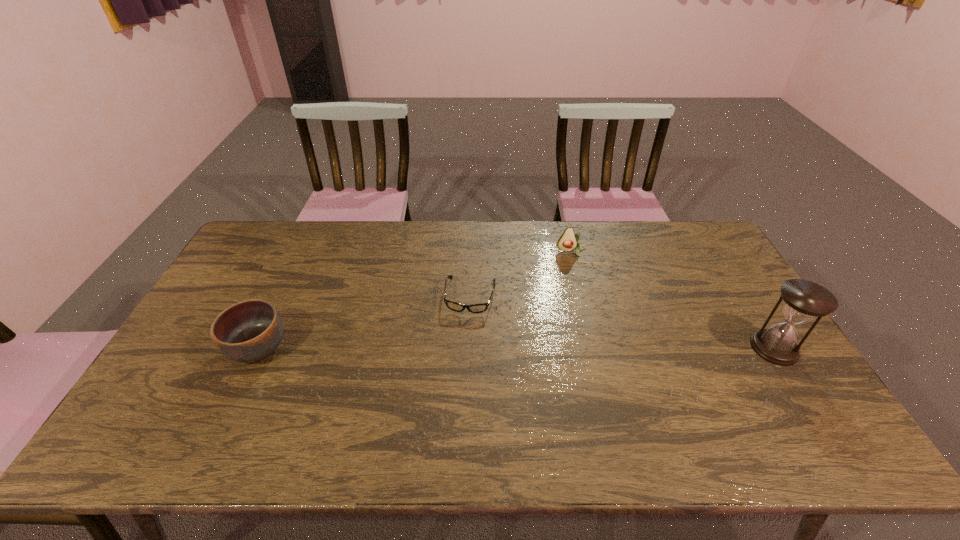
Identify the location of free area in between the rightmost object and the avocado. The height and width of the screenshot is (540, 960). (673, 300).

Where is `empty location between the hourglass and the avocado`? The height and width of the screenshot is (540, 960). empty location between the hourglass and the avocado is located at coordinates (673, 300).

You are a GUI agent. You are given a task and a screenshot of the screen. Output one action in this format:
    pyautogui.click(x=<x>, y=<y>)
    Task: Click on the vacant area between the bowl and the hourglass
    This screenshot has height=540, width=960.
    Given the screenshot: What is the action you would take?
    pyautogui.click(x=516, y=348)

Choose which object is the nearest neighbor to the spectacles. Please provide its 2D coordinates. Your answer should be formatted as a tuple, i.e. [(x, y)], where the tuple contains the x and y coordinates of a point satisfying the conditions above.

[(568, 241)]

Locate which object ranks third in proximity to the tallest object. Please provide its 2D coordinates. Your answer should be formatted as a tuple, i.e. [(x, y)], where the tuple contains the x and y coordinates of a point satisfying the conditions above.

[(248, 331)]

Locate an element on the screen. This screenshot has height=540, width=960. blank space that satisfies the following two spatial constraints: 1. on the back side of the avocado; 2. on the right side of the bowl is located at coordinates (304, 252).

At what (x,y) coordinates should I click in order to perform the action: click on blank area in the image that satisfies the following two spatial constraints: 1. on the front side of the spectacles; 2. on the right side of the hourglass. Please return your answer as a coordinate pair (x, y). The width and height of the screenshot is (960, 540). Looking at the image, I should click on (469, 348).